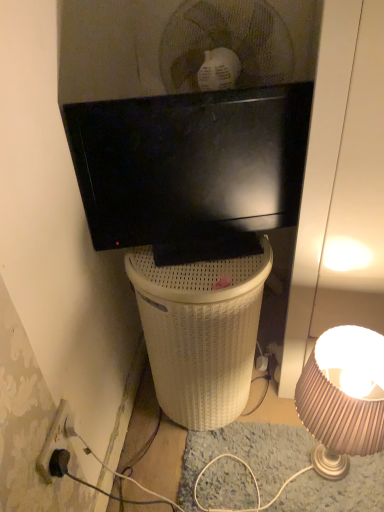
Question: From their relative heights in the image, would you say black plastic power outlet at lower left is taller or shorter than white wicker trash bin/can at center?

Choices:
 (A) short
 (B) tall

Answer: (A)

Question: Considering the positions of point (64, 413) and point (246, 258), is point (64, 413) closer or farther from the camera than point (246, 258)?

Choices:
 (A) farther
 (B) closer

Answer: (B)

Question: Considering the real-world distances, which object is closest to the matte beige lampshade at lower right?

Choices:
 (A) black plastic power outlet at lower left
 (B) matte black tv at upper center
 (C) white wicker trash bin/can at center

Answer: (C)

Question: Based on their relative distances, which object is nearer to the matte black tv at upper center?

Choices:
 (A) matte beige lampshade at lower right
 (B) white wicker trash bin/can at center
 (C) black plastic power outlet at lower left

Answer: (B)